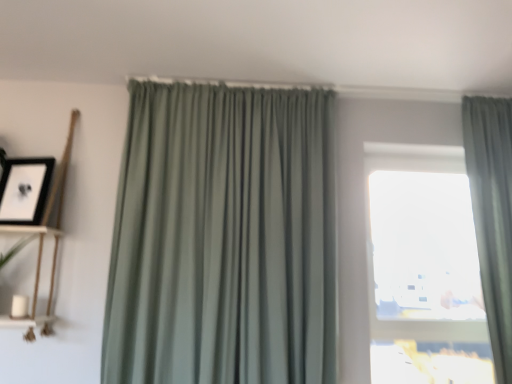
What do you see at coordinates (35, 283) in the screenshot?
I see `white matte shelf at left, placed as the first shelf when sorted from bottom to top` at bounding box center [35, 283].

The width and height of the screenshot is (512, 384). What do you see at coordinates (223, 238) in the screenshot? I see `sage green fabric curtain at center, the first curtain when ordered from left to right` at bounding box center [223, 238].

Describe the element at coordinates (492, 215) in the screenshot. The height and width of the screenshot is (384, 512). I see `sage green drapery at right, which appears as the first curtain when viewed from the right` at that location.

Image resolution: width=512 pixels, height=384 pixels. What do you see at coordinates (42, 241) in the screenshot?
I see `wooden shelf at left, which is the second shelf from bottom to top` at bounding box center [42, 241].

In order to click on black matte picture frame at upper left in this screenshot , I will do `click(24, 190)`.

What are the coordinates of `white matte shelf at left, placed as the first shelf when sorted from bottom to top` in the screenshot? It's located at (35, 283).

Considering the positions of objects black matte picture frame at upper left and sage green fabric curtain at center, positioned as the 2th curtain in right-to-left order, in the image provided, who is more to the right, black matte picture frame at upper left or sage green fabric curtain at center, positioned as the 2th curtain in right-to-left order,?

From the viewer's perspective, sage green fabric curtain at center, positioned as the 2th curtain in right-to-left order, appears more on the right side.

From the picture: Would you say black matte picture frame at upper left is inside or outside sage green fabric curtain at center, the first curtain when ordered from left to right?

black matte picture frame at upper left is outside sage green fabric curtain at center, the first curtain when ordered from left to right.

Does black matte picture frame at upper left have a greater width compared to sage green fabric curtain at center, positioned as the 2th curtain in right-to-left order?

In fact, black matte picture frame at upper left might be narrower than sage green fabric curtain at center, positioned as the 2th curtain in right-to-left order.

In terms of height, does sage green fabric curtain at center, positioned as the 2th curtain in right-to-left order, look taller or shorter compared to sage green drapery at right, which appears as the first curtain when viewed from the right?

Clearly, sage green fabric curtain at center, positioned as the 2th curtain in right-to-left order, is taller compared to sage green drapery at right, which appears as the first curtain when viewed from the right.

Is the position of sage green fabric curtain at center, positioned as the 2th curtain in right-to-left order, more distant than that of sage green drapery at right, which appears as the first curtain when viewed from the right?

No.

Is sage green fabric curtain at center, positioned as the 2th curtain in right-to-left order, facing towards sage green drapery at right, which appears as the first curtain when viewed from the right?

No.

Consider the image. Measure the distance between wooden shelf at left, which is the second shelf from bottom to top, and white matte shelf at left, acting as the 2th shelf starting from the top.

wooden shelf at left, which is the second shelf from bottom to top, and white matte shelf at left, acting as the 2th shelf starting from the top, are 2.15 inches apart.

Can you confirm if wooden shelf at left, which is the second shelf from bottom to top, is shorter than white matte shelf at left, placed as the first shelf when sorted from bottom to top?

No, wooden shelf at left, which is the second shelf from bottom to top, is not shorter than white matte shelf at left, placed as the first shelf when sorted from bottom to top.

From a real-world perspective, is wooden shelf at left, which is the second shelf from bottom to top, below white matte shelf at left, acting as the 2th shelf starting from the top?

Incorrect, from a real-world perspective, wooden shelf at left, which is the second shelf from bottom to top, is higher than white matte shelf at left, acting as the 2th shelf starting from the top.

Can you confirm if wooden shelf at left, which is the second shelf from bottom to top, is positioned to the left of white matte shelf at left, placed as the first shelf when sorted from bottom to top?

Yes, wooden shelf at left, which is the second shelf from bottom to top, is to the left of white matte shelf at left, placed as the first shelf when sorted from bottom to top.

Is sage green drapery at right, which is the 2th curtain from left to right, positioned with its back to white matte shelf at left, acting as the 2th shelf starting from the top?

sage green drapery at right, which is the 2th curtain from left to right, is not turned away from white matte shelf at left, acting as the 2th shelf starting from the top.

Which of these two, sage green drapery at right, which is the 2th curtain from left to right, or white matte shelf at left, placed as the first shelf when sorted from bottom to top, stands shorter?

With less height is white matte shelf at left, placed as the first shelf when sorted from bottom to top.

Relative to white matte shelf at left, acting as the 2th shelf starting from the top, is sage green drapery at right, which appears as the first curtain when viewed from the right, in front or behind?

sage green drapery at right, which appears as the first curtain when viewed from the right, is behind white matte shelf at left, acting as the 2th shelf starting from the top.

From a real-world perspective, between transparent glass window at center and black matte picture frame at upper left, who is vertically lower?

transparent glass window at center, from a real-world perspective.

Is transparent glass window at center placed right next to black matte picture frame at upper left?

No, transparent glass window at center is not in contact with black matte picture frame at upper left.

Between point (381, 259) and point (0, 216), which one is positioned behind?

Point (381, 259)

Between wooden shelf at left, which appears as the 1th shelf when viewed from the top, and black matte picture frame at upper left, which one is positioned in front?

Positioned in front is wooden shelf at left, which appears as the 1th shelf when viewed from the top.

How many degrees apart are the facing directions of wooden shelf at left, which is the second shelf from bottom to top, and black matte picture frame at upper left?

They differ by 15 degrees in their facing directions.

From a real-world perspective, which object rests below the other?

wooden shelf at left, which appears as the 1th shelf when viewed from the top, is physically lower.

Considering the positions of objects wooden shelf at left, which appears as the 1th shelf when viewed from the top, and black matte picture frame at upper left in the image provided, who is more to the left, wooden shelf at left, which appears as the 1th shelf when viewed from the top, or black matte picture frame at upper left?

wooden shelf at left, which appears as the 1th shelf when viewed from the top.

How much distance is there between wooden shelf at left, which appears as the 1th shelf when viewed from the top, and sage green drapery at right, which appears as the first curtain when viewed from the right?

A distance of 2.25 meters exists between wooden shelf at left, which appears as the 1th shelf when viewed from the top, and sage green drapery at right, which appears as the first curtain when viewed from the right.

From the picture: Which object is positioned more to the right, wooden shelf at left, which is the second shelf from bottom to top, or sage green drapery at right, which appears as the first curtain when viewed from the right?

sage green drapery at right, which appears as the first curtain when viewed from the right, is more to the right.

Between wooden shelf at left, which is the second shelf from bottom to top, and sage green drapery at right, which appears as the first curtain when viewed from the right, which one has less height?

With less height is wooden shelf at left, which is the second shelf from bottom to top.

Where is `curtain that is the 1st object to the right of the black matte picture frame at upper left, starting at the anchor`? curtain that is the 1st object to the right of the black matte picture frame at upper left, starting at the anchor is located at coordinates coord(223,238).

At what (x,y) coordinates should I click in order to perform the action: click on curtain below the sage green fabric curtain at center, positioned as the 2th curtain in right-to-left order (from the image's perspective). Please return your answer as a coordinate pair (x, y). This screenshot has height=384, width=512. Looking at the image, I should click on coord(492,215).

Which object lies nearer to the anchor point sage green fabric curtain at center, positioned as the 2th curtain in right-to-left order, transparent glass window at center or wooden shelf at left, which appears as the 1th shelf when viewed from the top?

The object closer to sage green fabric curtain at center, positioned as the 2th curtain in right-to-left order, is wooden shelf at left, which appears as the 1th shelf when viewed from the top.

Consider the image. Considering their positions, is sage green drapery at right, which appears as the first curtain when viewed from the right, positioned closer to transparent glass window at center than wooden shelf at left, which is the second shelf from bottom to top?

sage green drapery at right, which appears as the first curtain when viewed from the right, is closer to transparent glass window at center.

From the image, which object appears to be farther from black matte picture frame at upper left, sage green fabric curtain at center, the first curtain when ordered from left to right, or white matte shelf at left, placed as the first shelf when sorted from bottom to top?

The object further to black matte picture frame at upper left is sage green fabric curtain at center, the first curtain when ordered from left to right.

Considering their positions, is wooden shelf at left, which appears as the 1th shelf when viewed from the top, positioned closer to white matte shelf at left, acting as the 2th shelf starting from the top, than sage green fabric curtain at center, positioned as the 2th curtain in right-to-left order?

The object closer to white matte shelf at left, acting as the 2th shelf starting from the top, is wooden shelf at left, which appears as the 1th shelf when viewed from the top.

From the image, which object appears to be farther from sage green fabric curtain at center, positioned as the 2th curtain in right-to-left order, black matte picture frame at upper left or transparent glass window at center?

transparent glass window at center lies further to sage green fabric curtain at center, positioned as the 2th curtain in right-to-left order, than the other object.

Looking at the image, which one is located closer to sage green fabric curtain at center, the first curtain when ordered from left to right, black matte picture frame at upper left or wooden shelf at left, which appears as the 1th shelf when viewed from the top?

wooden shelf at left, which appears as the 1th shelf when viewed from the top, lies closer to sage green fabric curtain at center, the first curtain when ordered from left to right, than the other object.

Looking at the image, which one is located closer to white matte shelf at left, placed as the first shelf when sorted from bottom to top, sage green drapery at right, which appears as the first curtain when viewed from the right, or black matte picture frame at upper left?

black matte picture frame at upper left lies closer to white matte shelf at left, placed as the first shelf when sorted from bottom to top, than the other object.

When comparing their distances from black matte picture frame at upper left, does white matte shelf at left, acting as the 2th shelf starting from the top, or sage green drapery at right, which appears as the first curtain when viewed from the right, seem closer?

The object closer to black matte picture frame at upper left is white matte shelf at left, acting as the 2th shelf starting from the top.

The width and height of the screenshot is (512, 384). I want to click on picture frame between white matte shelf at left, acting as the 2th shelf starting from the top, and transparent glass window at center, in the horizontal direction, so click(x=24, y=190).

Locate an element on the screen. Image resolution: width=512 pixels, height=384 pixels. curtain between white matte shelf at left, placed as the first shelf when sorted from bottom to top, and sage green drapery at right, which appears as the first curtain when viewed from the right, from left to right is located at coordinates pos(223,238).

The height and width of the screenshot is (384, 512). In order to click on picture frame between white matte shelf at left, placed as the first shelf when sorted from bottom to top, and sage green drapery at right, which appears as the first curtain when viewed from the right in this screenshot , I will do tap(24, 190).

Where is `curtain between wooden shelf at left, which appears as the 1th shelf when viewed from the top, and sage green drapery at right, which appears as the first curtain when viewed from the right, from left to right`? The width and height of the screenshot is (512, 384). curtain between wooden shelf at left, which appears as the 1th shelf when viewed from the top, and sage green drapery at right, which appears as the first curtain when viewed from the right, from left to right is located at coordinates (223, 238).